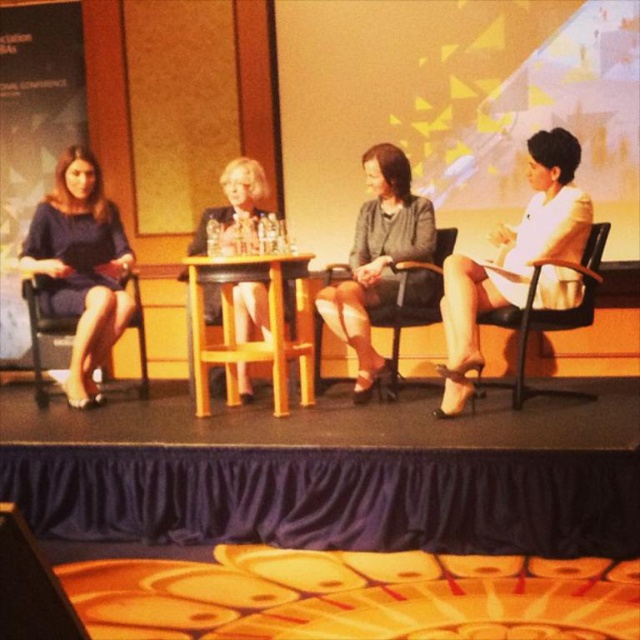
Is white satin dress at right positioned before black leather chair at center?

That is True.

This screenshot has width=640, height=640. What are the coordinates of `white satin dress at right` in the screenshot? It's located at (516, 260).

Does wooden chair at left have a greater width compared to black leather chair at center?

Yes, wooden chair at left is wider than black leather chair at center.

From the picture: Between wooden chair at left and black leather chair at center, which one appears on the left side from the viewer's perspective?

wooden chair at left is more to the left.

Between point (68, 324) and point (406, 314), which one is positioned behind?

The point (68, 324) is behind.

Locate an element on the screen. wooden chair at left is located at coordinates (44, 332).

Between wooden table at center and wooden chair at left, which one appears on the left side from the viewer's perspective?

wooden chair at left is more to the left.

Does wooden table at center appear over wooden chair at left?

Yes.

Who is more forward, [305,392] or [49,337]?

Point [305,392]

This screenshot has height=640, width=640. I want to click on wooden table at center, so [250, 339].